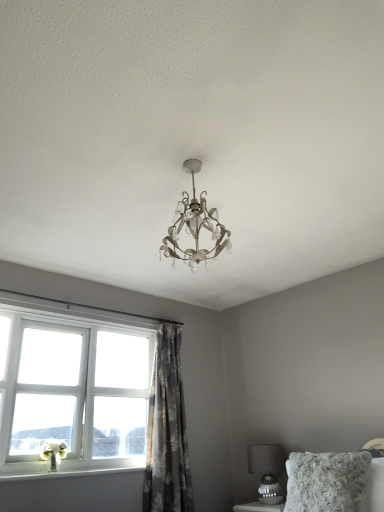
The height and width of the screenshot is (512, 384). I want to click on metallic silver table lamp at lower right, so click(267, 471).

Measure the distance between point (262, 478) and camera.

Point (262, 478) is 3.17 meters from camera.

You are a GUI agent. You are given a task and a screenshot of the screen. Output one action in this format:
    pyautogui.click(x=<x>, y=<y>)
    Task: Click on the white plastic window at lower left
    This screenshot has width=384, height=512.
    Given the screenshot: What is the action you would take?
    pyautogui.click(x=72, y=384)

This screenshot has width=384, height=512. Describe the element at coordinates (72, 384) in the screenshot. I see `white plastic window at lower left` at that location.

The image size is (384, 512). Find the location of `white painted wood at lower left`. white painted wood at lower left is located at coordinates (67, 473).

Identify the location of fluffy white pillow at lower right. (334, 484).

This screenshot has width=384, height=512. What are the coordinates of `gray floral fabric curtain at center` in the screenshot? It's located at pos(167,430).

Is white painted wood at lower left closer to the viewer compared to metallic silver table lamp at lower right?

That is True.

Is metallic silver table lamp at lower right inside white painted wood at lower left?

Definitely not — metallic silver table lamp at lower right is not inside white painted wood at lower left.

In the image, there is a metallic silver table lamp at lower right. Where is `window sill above it (from the image's perspective)`? The image size is (384, 512). window sill above it (from the image's perspective) is located at coordinates (67, 473).

Between gray floral fabric curtain at center and fluffy white pillow at lower right, which one is positioned behind?

gray floral fabric curtain at center is further from the camera.

Looking at their sizes, would you say gray floral fabric curtain at center is wider or thinner than fluffy white pillow at lower right?

Clearly, gray floral fabric curtain at center has less width compared to fluffy white pillow at lower right.

Can you tell me how much gray floral fabric curtain at center and fluffy white pillow at lower right differ in facing direction?

The facing directions of gray floral fabric curtain at center and fluffy white pillow at lower right are 82.1 degrees apart.

From the image's perspective, is gray floral fabric curtain at center located beneath fluffy white pillow at lower right?

No.

Based on the photo, is fluffy white pillow at lower right turned away from white plastic window at lower left?

No, white plastic window at lower left is not at the back of fluffy white pillow at lower right.

Consider the image. How different are the orientations of fluffy white pillow at lower right and white plastic window at lower left in degrees?

82.8 degrees.

Can you confirm if fluffy white pillow at lower right is thinner than white plastic window at lower left?

In fact, fluffy white pillow at lower right might be wider than white plastic window at lower left.

Is fluffy white pillow at lower right far away from white plastic window at lower left?

Yes, fluffy white pillow at lower right is far from white plastic window at lower left.

Are white painted wood at lower left and gray floral fabric curtain at center far apart?

white painted wood at lower left is actually quite close to gray floral fabric curtain at center.

From a real-world perspective, is white painted wood at lower left positioned above or below gray floral fabric curtain at center?

white painted wood at lower left is below gray floral fabric curtain at center.

Does white painted wood at lower left have a lesser height compared to gray floral fabric curtain at center?

Indeed, white painted wood at lower left has a lesser height compared to gray floral fabric curtain at center.

Is white painted wood at lower left facing towards gray floral fabric curtain at center?

No, white painted wood at lower left is not oriented towards gray floral fabric curtain at center.

Is metallic silver table lamp at lower right looking in the opposite direction of white plastic window at lower left?

No, metallic silver table lamp at lower right is not facing away from white plastic window at lower left.

From the picture: Is there a large distance between metallic silver table lamp at lower right and white plastic window at lower left?

metallic silver table lamp at lower right is positioned a significant distance from white plastic window at lower left.

At what (x,y) coordinates should I click in order to perform the action: click on window sill that is in front of the metallic silver table lamp at lower right. Please return your answer as a coordinate pair (x, y). The image size is (384, 512). Looking at the image, I should click on (67, 473).

Which is in front, point (265, 452) or point (58, 473)?

The point (58, 473) is more forward.

From a real-world perspective, is metallic silver table lamp at lower right physically located above or below white painted wood at lower left?

In terms of real-world spatial position, metallic silver table lamp at lower right is below white painted wood at lower left.

How many degrees apart are the facing directions of metallic silver table lamp at lower right and white painted wood at lower left?

They differ by 90 degrees in their facing directions.

Considering the relative sizes of gray floral fabric curtain at center and metallic silver table lamp at lower right in the image provided, is gray floral fabric curtain at center taller than metallic silver table lamp at lower right?

Correct, gray floral fabric curtain at center is much taller as metallic silver table lamp at lower right.

Considering the positions of objects gray floral fabric curtain at center and metallic silver table lamp at lower right in the image provided, who is more to the left, gray floral fabric curtain at center or metallic silver table lamp at lower right?

From the viewer's perspective, gray floral fabric curtain at center appears more on the left side.

Is gray floral fabric curtain at center next to metallic silver table lamp at lower right?

No, gray floral fabric curtain at center is not with metallic silver table lamp at lower right.

Could you tell me if gray floral fabric curtain at center is turned towards metallic silver table lamp at lower right?

No, gray floral fabric curtain at center is not facing towards metallic silver table lamp at lower right.

You are a GUI agent. You are given a task and a screenshot of the screen. Output one action in this format:
    pyautogui.click(x=<x>, y=<y>)
    Task: Click on the table lamp on the right of white painted wood at lower left
    Image resolution: width=384 pixels, height=512 pixels.
    Given the screenshot: What is the action you would take?
    pyautogui.click(x=267, y=471)

This screenshot has height=512, width=384. What are the coordinates of `curtain on the left of fluffy white pillow at lower right` in the screenshot? It's located at (167, 430).

When comparing their distances from white plastic window at lower left, does metallic silver table lamp at lower right or white painted wood at lower left seem closer?

white painted wood at lower left is closer to white plastic window at lower left.

Consider the image. Looking at the image, which one is located further to gray floral fabric curtain at center, metallic silver table lamp at lower right or white plastic window at lower left?

metallic silver table lamp at lower right.

Looking at the image, which one is located closer to fluffy white pillow at lower right, gray floral fabric curtain at center or white painted wood at lower left?

gray floral fabric curtain at center lies closer to fluffy white pillow at lower right than the other object.

From the image, which object appears to be nearer to fluffy white pillow at lower right, white painted wood at lower left or white plastic window at lower left?

white painted wood at lower left is closer to fluffy white pillow at lower right.

Based on their spatial positions, is white plastic window at lower left or fluffy white pillow at lower right closer to white painted wood at lower left?

Based on the image, white plastic window at lower left appears to be nearer to white painted wood at lower left.

Estimate the real-world distances between objects in this image. Which object is closer to metallic silver table lamp at lower right, white plastic window at lower left or fluffy white pillow at lower right?

fluffy white pillow at lower right is positioned closer to the anchor metallic silver table lamp at lower right.

From the image, which object appears to be nearer to white painted wood at lower left, fluffy white pillow at lower right or gray floral fabric curtain at center?

The object closer to white painted wood at lower left is gray floral fabric curtain at center.

Which object lies nearer to the anchor point metallic silver table lamp at lower right, fluffy white pillow at lower right or white painted wood at lower left?

Among the two, fluffy white pillow at lower right is located nearer to metallic silver table lamp at lower right.

I want to click on table lamp situated between white painted wood at lower left and fluffy white pillow at lower right from left to right, so click(267, 471).

Where is `window sill between white plastic window at lower left and fluffy white pillow at lower right in the horizontal direction`? window sill between white plastic window at lower left and fluffy white pillow at lower right in the horizontal direction is located at coordinates (67, 473).

What are the coordinates of `table lamp located between gray floral fabric curtain at center and fluffy white pillow at lower right in the left-right direction` in the screenshot? It's located at point(267,471).

This screenshot has height=512, width=384. In order to click on curtain between white plastic window at lower left and fluffy white pillow at lower right from left to right in this screenshot , I will do `click(167, 430)`.